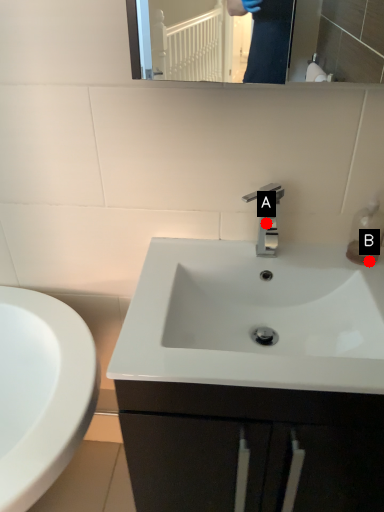
Question: Two points are circled on the image, labeled by A and B beside each circle. Which point is further to the camera?

Choices:
 (A) A is further
 (B) B is further

Answer: (A)